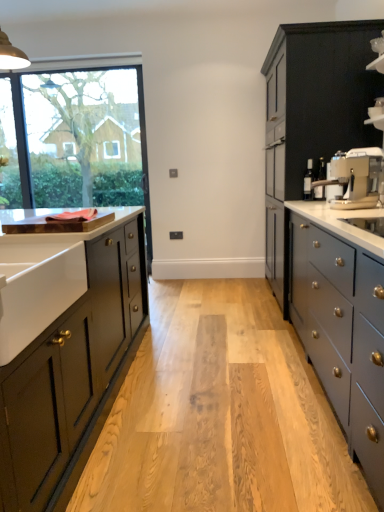
Question: Is the depth of satin silver coffee machine at right greater than that of white ceramic sink at left?

Choices:
 (A) yes
 (B) no

Answer: (A)

Question: Can you see satin silver coffee machine at right touching white ceramic sink at left?

Choices:
 (A) no
 (B) yes

Answer: (A)

Question: From a real-world perspective, is satin silver coffee machine at right positioned over white ceramic sink at left based on gravity?

Choices:
 (A) no
 (B) yes

Answer: (B)

Question: Is satin silver coffee machine at right taller than white ceramic sink at left?

Choices:
 (A) yes
 (B) no

Answer: (A)

Question: Is satin silver coffee machine at right shorter than white ceramic sink at left?

Choices:
 (A) yes
 (B) no

Answer: (B)

Question: From their relative heights in the image, would you say satin silver coffee machine at right is taller or shorter than white ceramic sink at left?

Choices:
 (A) tall
 (B) short

Answer: (A)

Question: In terms of size, does satin silver coffee machine at right appear bigger or smaller than white ceramic sink at left?

Choices:
 (A) big
 (B) small

Answer: (B)

Question: From the image's perspective, relative to white ceramic sink at left, is satin silver coffee machine at right above or below?

Choices:
 (A) above
 (B) below

Answer: (A)

Question: Is satin silver coffee machine at right inside the boundaries of white ceramic sink at left, or outside?

Choices:
 (A) outside
 (B) inside

Answer: (A)

Question: Based on their positions, is clear glass window at upper left located to the left or right of brown wood cutting board at left?

Choices:
 (A) left
 (B) right

Answer: (A)

Question: From a real-world perspective, relative to brown wood cutting board at left, is clear glass window at upper left vertically above or below?

Choices:
 (A) above
 (B) below

Answer: (A)

Question: Is clear glass window at upper left spatially inside brown wood cutting board at left, or outside of it?

Choices:
 (A) inside
 (B) outside

Answer: (B)

Question: Is clear glass window at upper left bigger or smaller than brown wood cutting board at left?

Choices:
 (A) big
 (B) small

Answer: (A)

Question: Considering the positions of matte gray countertop at right and satin silver coffee machine at right in the image, is matte gray countertop at right bigger or smaller than satin silver coffee machine at right?

Choices:
 (A) big
 (B) small

Answer: (A)

Question: In terms of height, does matte gray countertop at right look taller or shorter compared to satin silver coffee machine at right?

Choices:
 (A) short
 (B) tall

Answer: (B)